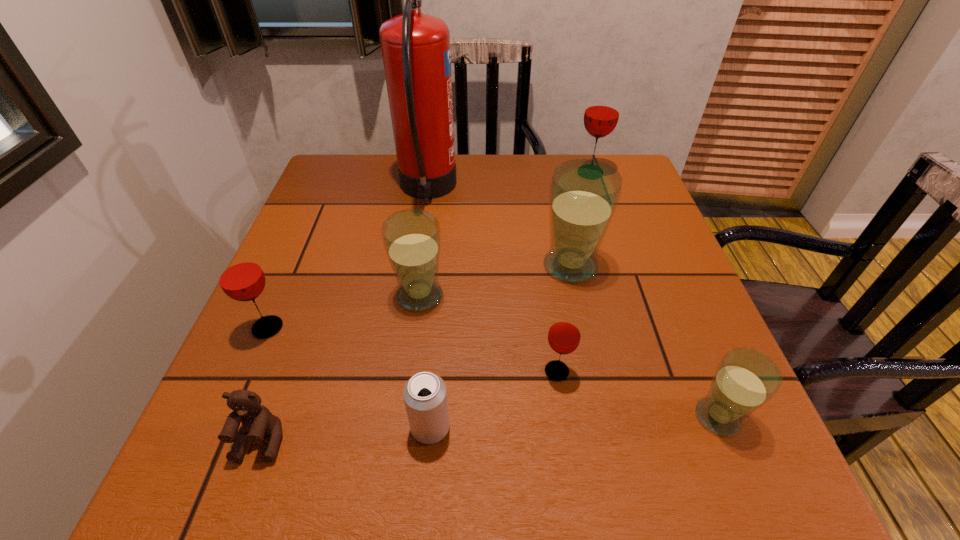
Select which red glass is the closest to the white beer can. Please provide its 2D coordinates. Your answer should be formatted as a tuple, i.e. [(x, y)], where the tuple contains the x and y coordinates of a point satisfying the conditions above.

[(564, 335)]

This screenshot has height=540, width=960. What are the coordinates of `blue glass that is the second closest to the second glass from left to right` in the screenshot? It's located at (745, 379).

Locate an element on the screen. blue glass that is the second closest to the fifth glass from right to left is located at coordinates (745, 379).

The image size is (960, 540). In order to click on free spot that satisfies the following two spatial constraints: 1. on the back side of the second glass from left to right; 2. on the surface of the tallest object in this screenshot , I will do `click(434, 191)`.

Find the location of `vacant region that satisfies the following two spatial constraints: 1. on the front side of the second smallest red glass; 2. on the right side of the sixth farthest object`. vacant region that satisfies the following two spatial constraints: 1. on the front side of the second smallest red glass; 2. on the right side of the sixth farthest object is located at coordinates (249, 372).